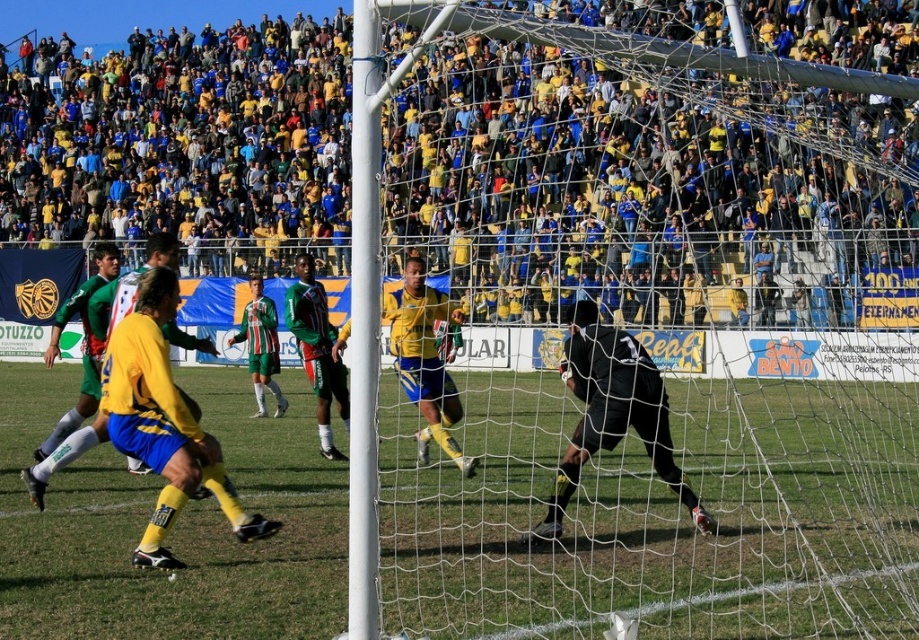
You are a soccer coach analyzing the field layout. You notice the green striped jersey at center and the green grass football field at center. Which one appears narrower in the image?

The green striped jersey at center has a lesser width compared to the green grass football field at center, so the green striped jersey at center appears narrower.